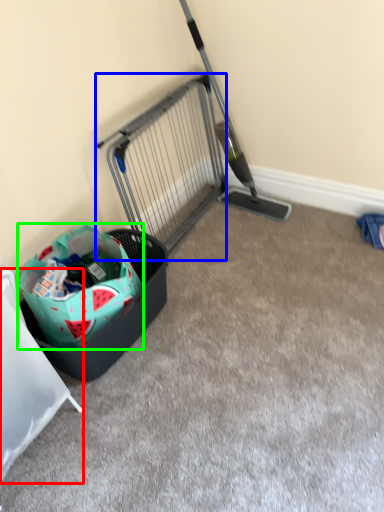
Question: Which is nearer to the furniture (highlighted by a red box)? cage (highlighted by a blue box) or shopping bag (highlighted by a green box).

Choices:
 (A) cage
 (B) shopping bag

Answer: (B)